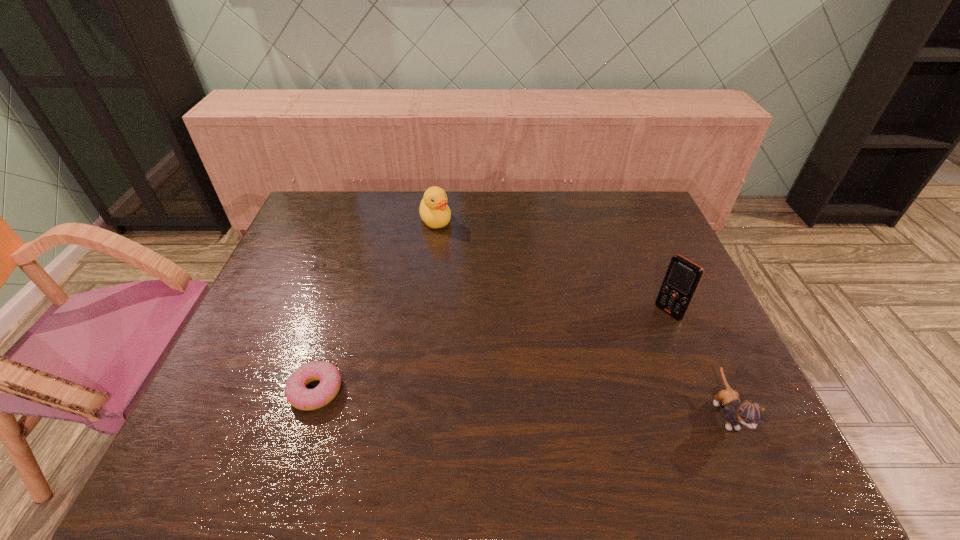
You are a GUI agent. You are given a task and a screenshot of the screen. Output one action in this format:
    pyautogui.click(x=<x>, y=<y>)
    Task: Click on the vacant area that lies between the second tallest object and the cellular telephone
    
    Given the screenshot: What is the action you would take?
    pyautogui.click(x=552, y=266)

Find the location of a particular element. free space between the shortest object and the farthest object is located at coordinates (376, 306).

Identify the location of free space between the leftmost object and the farthest object. This screenshot has width=960, height=540. (376, 306).

Locate an element on the screen. This screenshot has width=960, height=540. vacant point located between the doughnut and the cellular telephone is located at coordinates (492, 352).

What are the coordinates of `unoccupied position between the doughnut and the cellular telephone` in the screenshot? It's located at (492, 352).

Select which object appears as the closest to the doughnut. Please provide its 2D coordinates. Your answer should be formatted as a tuple, i.e. [(x, y)], where the tuple contains the x and y coordinates of a point satisfying the conditions above.

[(434, 211)]

Find the location of a particular element. the second closest object relative to the second farthest object is located at coordinates (434, 211).

The width and height of the screenshot is (960, 540). I want to click on free point that satisfies the following two spatial constraints: 1. on the back side of the farthest object; 2. on the left side of the shortest object, so click(x=370, y=220).

Locate an element on the screen. This screenshot has height=540, width=960. vacant point that satisfies the following two spatial constraints: 1. on the front side of the duck; 2. on the left side of the cellular telephone is located at coordinates coord(424,313).